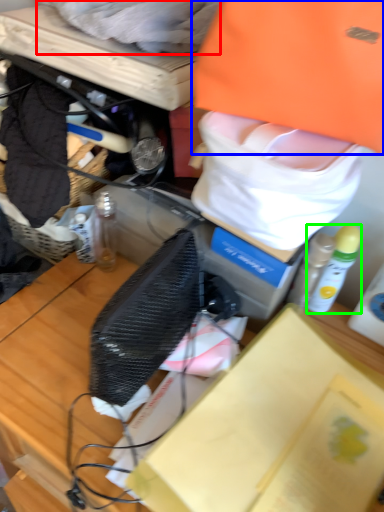
Question: Which is nearer to the clothing (highlighted by a red box)? clothing (highlighted by a blue box) or bottle (highlighted by a green box).

Choices:
 (A) clothing
 (B) bottle

Answer: (A)